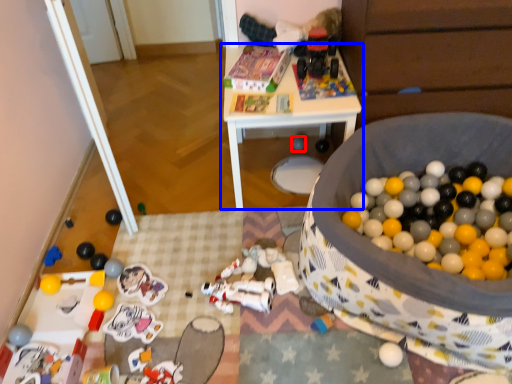
Question: Which object is closer to the camera taking this photo, toy (highlighted by a red box) or table (highlighted by a blue box)?

Choices:
 (A) toy
 (B) table

Answer: (B)